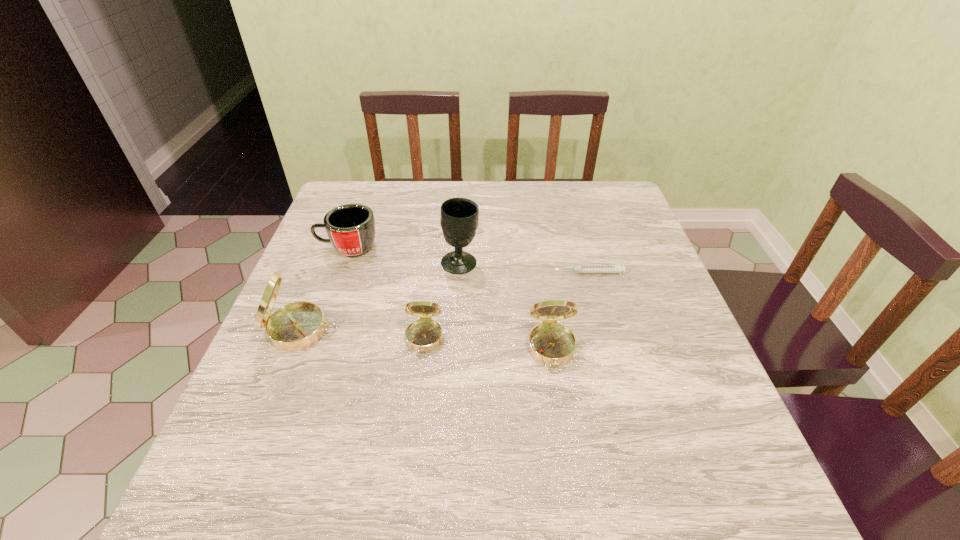
Identify the location of the leftmost compass. (296, 326).

At what (x,y) coordinates should I click in order to perform the action: click on the second compass from left to right. Please return your answer as a coordinate pair (x, y). Looking at the image, I should click on (425, 334).

The width and height of the screenshot is (960, 540). Identify the location of the third tallest object. tap(553, 344).

The height and width of the screenshot is (540, 960). Identify the location of the rightmost compass. (553, 344).

Find the location of a particular element. This screenshot has width=960, height=540. chalice is located at coordinates (459, 220).

Find the location of a particular element. syringe is located at coordinates [x=580, y=268].

Find the location of `mug`. mug is located at coordinates (351, 229).

This screenshot has width=960, height=540. I want to click on free location located 0.100m with the dial facing the leftmost compass, so click(x=383, y=330).

This screenshot has width=960, height=540. What are the coordinates of `vacant space located 0.160m with the dial facing the second compass from left to right` in the screenshot? It's located at (413, 431).

You are a GUI agent. You are given a task and a screenshot of the screen. Output one action in this format:
    pyautogui.click(x=<x>, y=<y>)
    Task: Click on the free location located 0.120m with the dial facing the fourth shortest object
    The height and width of the screenshot is (540, 960).
    Given the screenshot: What is the action you would take?
    pyautogui.click(x=564, y=430)